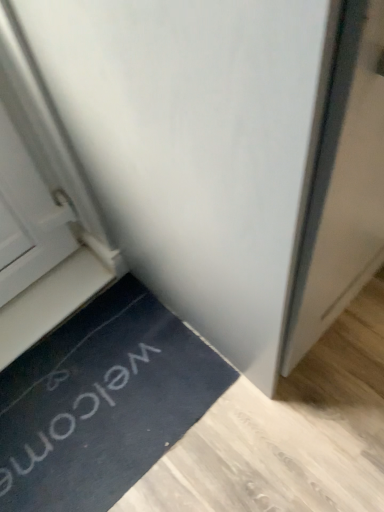
At what (x,y) coordinates should I click in order to perform the action: click on blank space situated above black rubber doormat at lower left (from a real-world perspective). Please return your answer as a coordinate pair (x, y). This screenshot has height=512, width=384. Looking at the image, I should click on (96, 396).